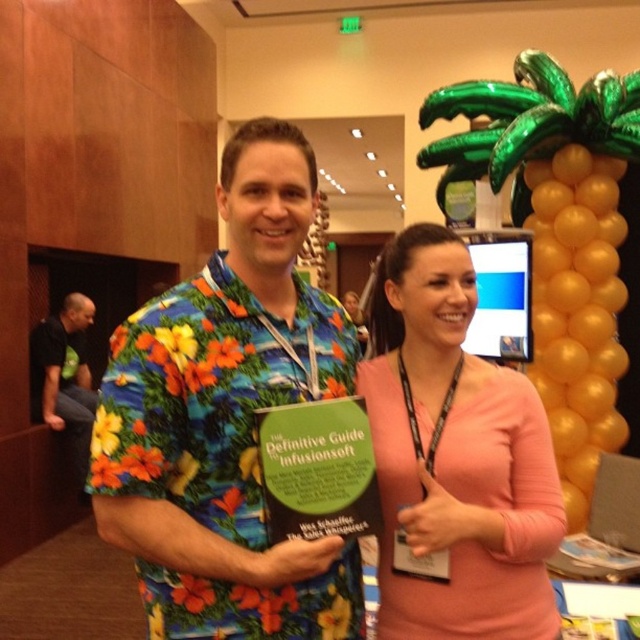
Is floral print shirt at center closer to the viewer compared to black fabric shirt at left?

Yes, it is in front of black fabric shirt at left.

Who is positioned more to the left, floral print shirt at center or black fabric shirt at left?

Positioned to the left is black fabric shirt at left.

Measure the distance between floral print shirt at center and camera.

They are 1.07 meters apart.

Find the location of a particular element. This screenshot has height=640, width=640. floral print shirt at center is located at coordinates click(x=227, y=419).

Can you confirm if floral print shirt at center is thinner than pink matte shirt at center?

No, floral print shirt at center is not thinner than pink matte shirt at center.

Does point (236, 355) come behind point (442, 355)?

No, it is in front of (442, 355).

The height and width of the screenshot is (640, 640). Identify the location of floral print shirt at center. (227, 419).

Is pink matte shirt at center positioned before black fabric shirt at left?

Yes.

Does point (520, 547) come closer to viewer compared to point (74, 355)?

Yes, point (520, 547) is closer to viewer.

Measure the distance between pink matte shirt at center and camera.

pink matte shirt at center and camera are 1.14 meters apart.

What are the coordinates of `pink matte shirt at center` in the screenshot? It's located at coord(454,458).